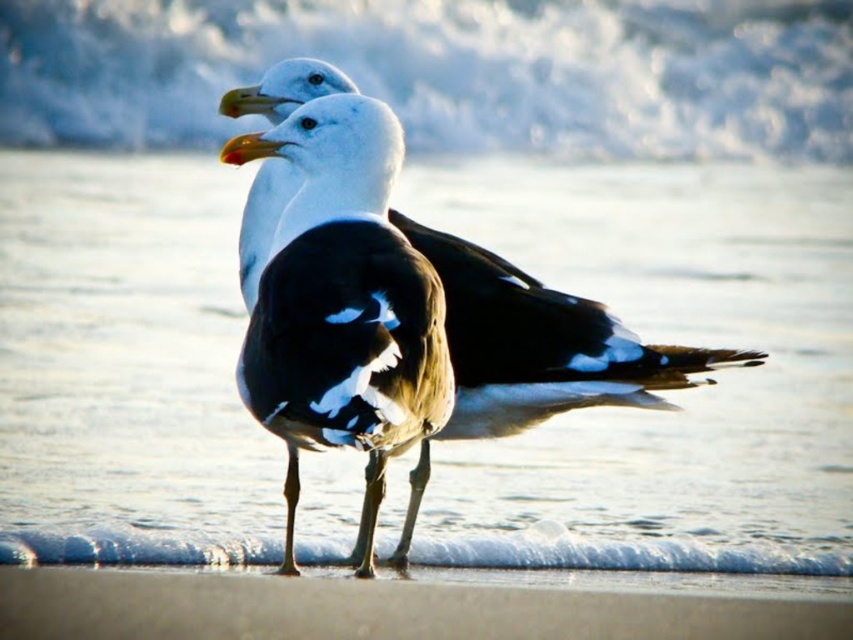
Who is taller, clear water at center or white frothy wave at upper center?

clear water at center

Find the location of `clear water at center`. clear water at center is located at coordinates (665, 392).

Who is more distant from viewer, (77, 212) or (732, 65)?

Point (732, 65)

Locate an element on the screen. Image resolution: width=853 pixels, height=640 pixels. clear water at center is located at coordinates (665, 392).

Is clear water at center bigger than yellow-orange beak at center?

Yes.

The image size is (853, 640). I want to click on clear water at center, so click(665, 392).

Does white frothy wave at upper center have a greater height compared to yellow-orange beak at center?

Indeed, white frothy wave at upper center has a greater height compared to yellow-orange beak at center.

Is point (115, 4) positioned in front of point (227, 145)?

No, it is not.

Locate an element on the screen. This screenshot has width=853, height=640. white frothy wave at upper center is located at coordinates (447, 72).